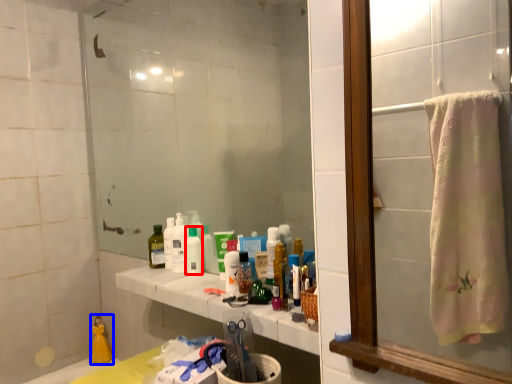
Question: Among these objects, which one is farthest to the camera, mouthwash (highlighted by a red box) or product (highlighted by a blue box)?

Choices:
 (A) mouthwash
 (B) product

Answer: (B)